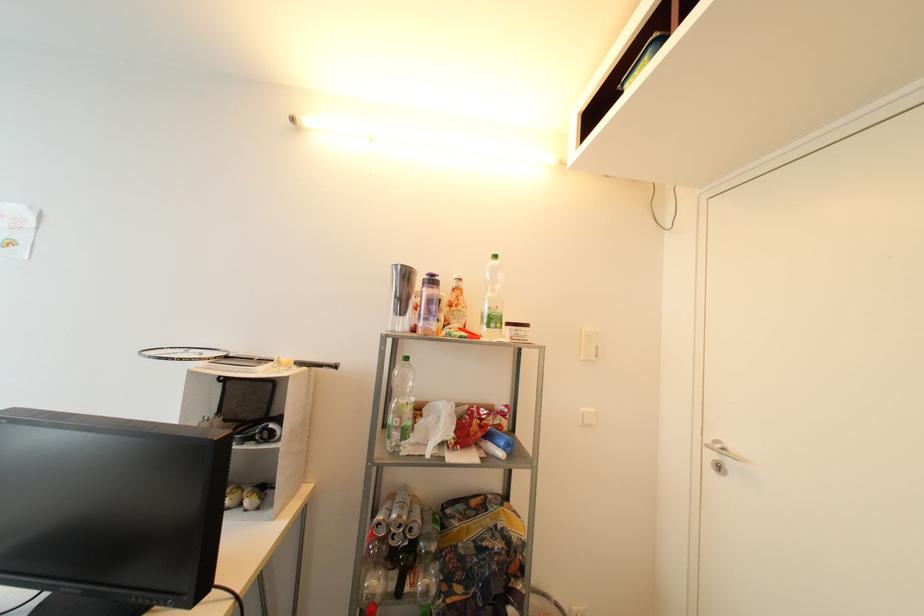
What do you see at coordinates (590, 344) in the screenshot?
I see `a white light switch` at bounding box center [590, 344].